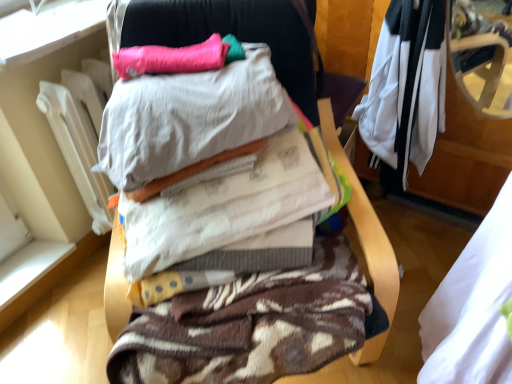
At what (x,y) coordinates should I click in order to perform the action: click on brown textured blanket at center. Please return your answer as a coordinate pair (x, y). Looking at the image, I should click on (364, 220).

This screenshot has width=512, height=384. What do you see at coordinates (473, 307) in the screenshot?
I see `white fabric at right, placed as the 1th clothing when sorted from front to back` at bounding box center [473, 307].

The width and height of the screenshot is (512, 384). I want to click on brown textured blanket at center, so click(364, 220).

Who is shorter, white fabric at right, the fourth clothing from the back, or pink fluffy pillow at upper center, which ranks as the first pillow in back-to-front order?

pink fluffy pillow at upper center, which ranks as the first pillow in back-to-front order, is shorter.

Between white fabric at right, the fourth clothing from the back, and pink fluffy pillow at upper center, positioned as the second pillow in front-to-back order, which one appears on the right side from the viewer's perspective?

From the viewer's perspective, white fabric at right, the fourth clothing from the back, appears more on the right side.

Is white fabric at right, the fourth clothing from the back, wider or thinner than pink fluffy pillow at upper center, which ranks as the first pillow in back-to-front order?

white fabric at right, the fourth clothing from the back, is wider than pink fluffy pillow at upper center, which ranks as the first pillow in back-to-front order.

Considering the positions of point (456, 362) and point (222, 66), is point (456, 362) closer or farther from the camera than point (222, 66)?

Point (456, 362).

Is soft cotton pillow at center, the second pillow from the back, not within white/black fabric jacket at upper right, the fourth clothing when ordered from front to back?

soft cotton pillow at center, the second pillow from the back, is positioned outside white/black fabric jacket at upper right, the fourth clothing when ordered from front to back.

From a real-world perspective, relative to white/black fabric jacket at upper right, the 1th clothing when ordered from back to front, is soft cotton pillow at center, the 1th pillow viewed from the front, vertically above or below?

soft cotton pillow at center, the 1th pillow viewed from the front, is above white/black fabric jacket at upper right, the 1th clothing when ordered from back to front.

Considering the positions of objects soft cotton pillow at center, the 1th pillow viewed from the front, and white/black fabric jacket at upper right, the fourth clothing when ordered from front to back, in the image provided, who is more to the right, soft cotton pillow at center, the 1th pillow viewed from the front, or white/black fabric jacket at upper right, the fourth clothing when ordered from front to back,?

From the viewer's perspective, white/black fabric jacket at upper right, the fourth clothing when ordered from front to back, appears more on the right side.

Is soft cotton pillow at center, the 1th pillow viewed from the front, positioned far away from white/black fabric jacket at upper right, the fourth clothing when ordered from front to back?

Actually, soft cotton pillow at center, the 1th pillow viewed from the front, and white/black fabric jacket at upper right, the fourth clothing when ordered from front to back, are a little close together.

From the image's perspective, is brown textured blanket at center above brown knitted blanket at center, which appears as the second clothing when viewed from the back?

Yes.

Would you say brown textured blanket at center contains brown knitted blanket at center, which appears as the second clothing when viewed from the back?

Yes, brown textured blanket at center contains brown knitted blanket at center, which appears as the second clothing when viewed from the back.

Is point (112, 21) farther from camera compared to point (354, 336)?

Yes, it is.

From a real-world perspective, is white fabric at right, placed as the 1th clothing when sorted from front to back, located beneath white/black fabric jacket at upper right, the 1th clothing when ordered from back to front?

Correct, in the physical world, white fabric at right, placed as the 1th clothing when sorted from front to back, is lower than white/black fabric jacket at upper right, the 1th clothing when ordered from back to front.

Would you consider white fabric at right, the fourth clothing from the back, to be distant from white/black fabric jacket at upper right, the 1th clothing when ordered from back to front?

No, there isn't a large distance between white fabric at right, the fourth clothing from the back, and white/black fabric jacket at upper right, the 1th clothing when ordered from back to front.

Can you confirm if white fabric at right, the fourth clothing from the back, is shorter than white/black fabric jacket at upper right, the fourth clothing when ordered from front to back?

No, white fabric at right, the fourth clothing from the back, is not shorter than white/black fabric jacket at upper right, the fourth clothing when ordered from front to back.

Find the location of a particular element. the 2nd clothing above the white fabric at right, the fourth clothing from the back (from the image's perspective) is located at coordinates (405, 90).

Is brown knitted blanket at center, which appears as the second clothing when viewed from the back, situated inside brown textured blanket at center or outside?

brown knitted blanket at center, which appears as the second clothing when viewed from the back, is enclosed within brown textured blanket at center.

From the brown textured blanket at center, count 2nd clothings backward and point to it. Please provide its 2D coordinates.

[(250, 326)]

Which is closer to the camera, (144, 65) or (429, 364)?

Point (144, 65) is positioned farther from the camera compared to point (429, 364).

From a real-world perspective, which object rests below the other?

In real-world perspective, white fabric at right, placed as the 1th clothing when sorted from front to back, is lower.

From the image's perspective, which object appears higher, pink fluffy pillow at upper center, which ranks as the first pillow in back-to-front order, or white fabric at right, placed as the 1th clothing when sorted from front to back?

From the image's view, pink fluffy pillow at upper center, which ranks as the first pillow in back-to-front order, is above.

Who is bigger, pink fluffy pillow at upper center, which ranks as the first pillow in back-to-front order, or white fabric at right, placed as the 1th clothing when sorted from front to back?

Bigger between the two is white fabric at right, placed as the 1th clothing when sorted from front to back.

Which pillow is the 2nd one when counting from the left side of the brown textured blanket at center? Please provide its 2D coordinates.

[(170, 58)]

From the picture: Is brown textured blanket at center in contact with pink fluffy pillow at upper center, positioned as the second pillow in front-to-back order?

No.

From a real-world perspective, is brown textured blanket at center located beneath pink fluffy pillow at upper center, positioned as the second pillow in front-to-back order?

Yes, from a real-world perspective, brown textured blanket at center is below pink fluffy pillow at upper center, positioned as the second pillow in front-to-back order.

Which object is wider, brown textured blanket at center or pink fluffy pillow at upper center, positioned as the second pillow in front-to-back order?

brown textured blanket at center is wider.

This screenshot has width=512, height=384. Identify the location of clothing that is the 3rd one when counting forward from the pink fluffy pillow at upper center, positioned as the second pillow in front-to-back order. (473, 307).

Which pillow is the 1st one when counting from the left side of the white/black fabric jacket at upper right, the 1th clothing when ordered from back to front? Please provide its 2D coordinates.

[(189, 118)]

Looking at the image, which one is located closer to pink fluffy pillow at upper center, positioned as the second pillow in front-to-back order, white cotton sheets at center, the 3th clothing when ordered from back to front, or white fabric at right, the fourth clothing from the back?

white cotton sheets at center, the 3th clothing when ordered from back to front, is closer to pink fluffy pillow at upper center, positioned as the second pillow in front-to-back order.

Which object lies nearer to the anchor point pink fluffy pillow at upper center, which ranks as the first pillow in back-to-front order, white fabric at right, the fourth clothing from the back, or white cotton sheets at center, the 3th clothing when ordered from back to front?

The object closer to pink fluffy pillow at upper center, which ranks as the first pillow in back-to-front order, is white cotton sheets at center, the 3th clothing when ordered from back to front.

Considering their positions, is white cotton sheets at center, the 3th clothing when ordered from back to front, positioned closer to brown textured blanket at center than soft cotton pillow at center, the 1th pillow viewed from the front?

Based on the image, white cotton sheets at center, the 3th clothing when ordered from back to front, appears to be nearer to brown textured blanket at center.

Consider the image. Which object lies further to the anchor point white cotton sheets at center, which is the second clothing in front-to-back order, pink fluffy pillow at upper center, which ranks as the first pillow in back-to-front order, or soft cotton pillow at center, the 1th pillow viewed from the front?

Based on the image, pink fluffy pillow at upper center, which ranks as the first pillow in back-to-front order, appears to be further to white cotton sheets at center, which is the second clothing in front-to-back order.

Estimate the real-world distances between objects in this image. Which object is further from white/black fabric jacket at upper right, the fourth clothing when ordered from front to back, pink fluffy pillow at upper center, which ranks as the first pillow in back-to-front order, or white fabric at right, placed as the 1th clothing when sorted from front to back?

Among the two, pink fluffy pillow at upper center, which ranks as the first pillow in back-to-front order, is located further to white/black fabric jacket at upper right, the fourth clothing when ordered from front to back.

When comparing their distances from soft cotton pillow at center, the second pillow from the back, does white/black fabric jacket at upper right, the fourth clothing when ordered from front to back, or pink fluffy pillow at upper center, positioned as the second pillow in front-to-back order, seem closer?

Among the two, pink fluffy pillow at upper center, positioned as the second pillow in front-to-back order, is located nearer to soft cotton pillow at center, the second pillow from the back.

Estimate the real-world distances between objects in this image. Which object is further from white cotton sheets at center, the 3th clothing when ordered from back to front, white/black fabric jacket at upper right, the 1th clothing when ordered from back to front, or brown textured blanket at center?

white/black fabric jacket at upper right, the 1th clothing when ordered from back to front, is positioned further to the anchor white cotton sheets at center, the 3th clothing when ordered from back to front.

Considering their positions, is brown textured blanket at center positioned further to white fabric at right, placed as the 1th clothing when sorted from front to back, than soft cotton pillow at center, the 1th pillow viewed from the front?

soft cotton pillow at center, the 1th pillow viewed from the front, is positioned further to the anchor white fabric at right, placed as the 1th clothing when sorted from front to back.

Image resolution: width=512 pixels, height=384 pixels. Identify the location of pillow between pink fluffy pillow at upper center, which ranks as the first pillow in back-to-front order, and white fabric at right, placed as the 1th clothing when sorted from front to back, in the horizontal direction. (189, 118).

The image size is (512, 384). I want to click on furniture situated between pink fluffy pillow at upper center, positioned as the second pillow in front-to-back order, and white fabric at right, placed as the 1th clothing when sorted from front to back, from left to right, so click(364, 220).

Image resolution: width=512 pixels, height=384 pixels. In order to click on furniture between white cotton sheets at center, which is the second clothing in front-to-back order, and brown knitted blanket at center, which appears as the second clothing when viewed from the back, from top to bottom in this screenshot , I will do `click(364, 220)`.

Locate an element on the screen. pillow between pink fluffy pillow at upper center, which ranks as the first pillow in back-to-front order, and white/black fabric jacket at upper right, the fourth clothing when ordered from front to back is located at coordinates (189, 118).